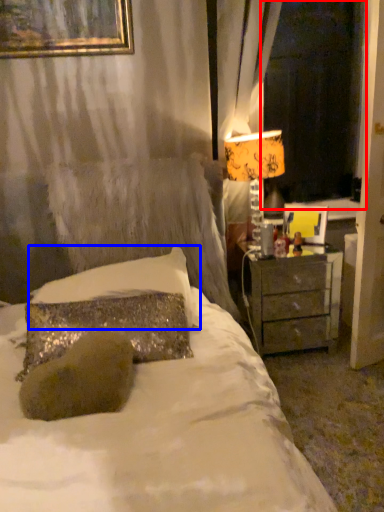
Question: Which point is further to the camera, window screen (highlighted by a red box) or pillow (highlighted by a blue box)?

Choices:
 (A) window screen
 (B) pillow

Answer: (A)